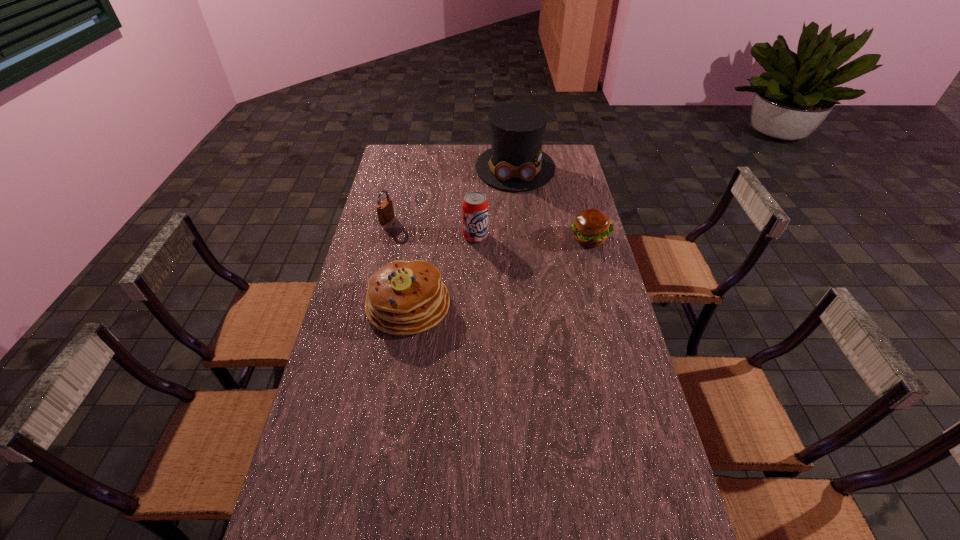
Where is `pancake`? This screenshot has height=540, width=960. pancake is located at coordinates (403, 298).

Where is `the shortest object`? This screenshot has width=960, height=540. the shortest object is located at coordinates (591, 227).

Where is `dress hat`? The height and width of the screenshot is (540, 960). dress hat is located at coordinates (516, 162).

This screenshot has height=540, width=960. What are the coordinates of `the farthest object` in the screenshot? It's located at (516, 162).

At what (x,y) coordinates should I click in order to perform the action: click on the second tallest object. Please return your answer as a coordinate pair (x, y). The width and height of the screenshot is (960, 540). Looking at the image, I should click on (475, 205).

Image resolution: width=960 pixels, height=540 pixels. In order to click on padlock in this screenshot , I will do `click(385, 211)`.

Locate an element on the screen. The height and width of the screenshot is (540, 960). free space located on the right of the pancake is located at coordinates (474, 305).

You are a GUI agent. You are given a task and a screenshot of the screen. Output one action in this format:
    pyautogui.click(x=<x>, y=<y>)
    Task: Click on the blank space located 0.360m on the back of the shortest object
    The width and height of the screenshot is (960, 540).
    Given the screenshot: What is the action you would take?
    pyautogui.click(x=572, y=177)

You are a GUI agent. You are given a task and a screenshot of the screen. Output one action in this format:
    pyautogui.click(x=<x>, y=<y>)
    Task: Click on the free space located 0.050m with goggles on the front of the tallest object
    The image size is (960, 540).
    Given the screenshot: What is the action you would take?
    pyautogui.click(x=516, y=200)

This screenshot has height=540, width=960. Identify the location of blank area located 0.400m with goggles on the front of the tallest object. (519, 255).